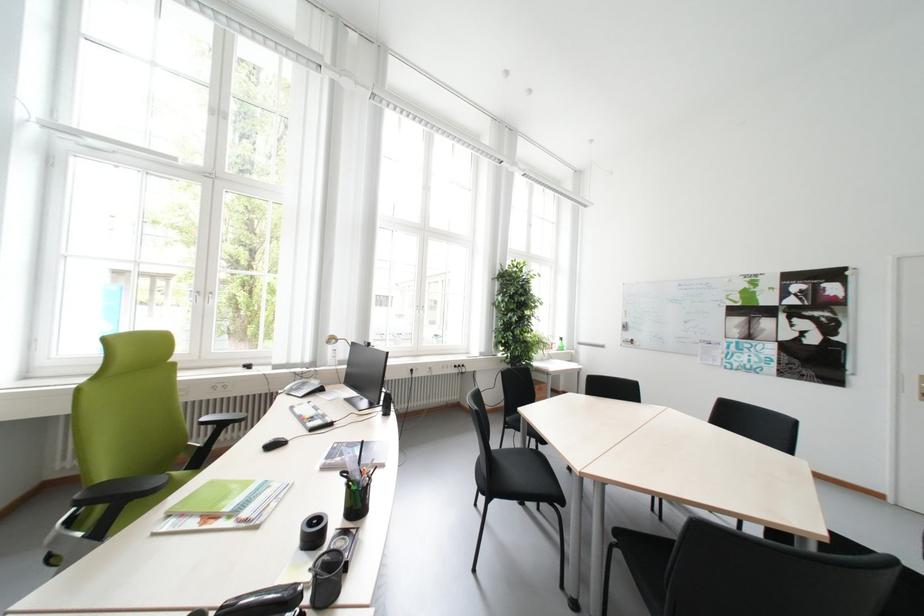
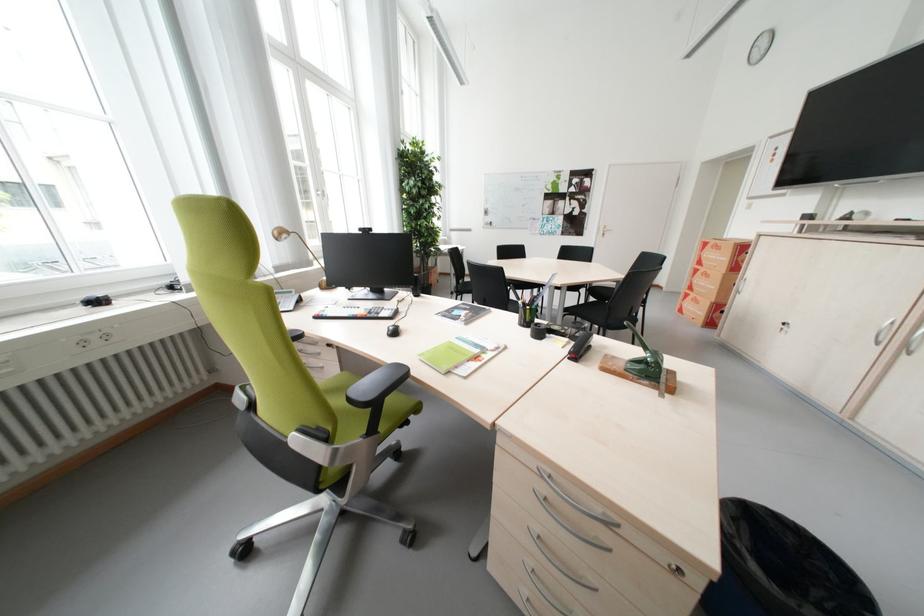
Find the pixel in the second image that matches point (229, 387) in the first image.

(104, 339)